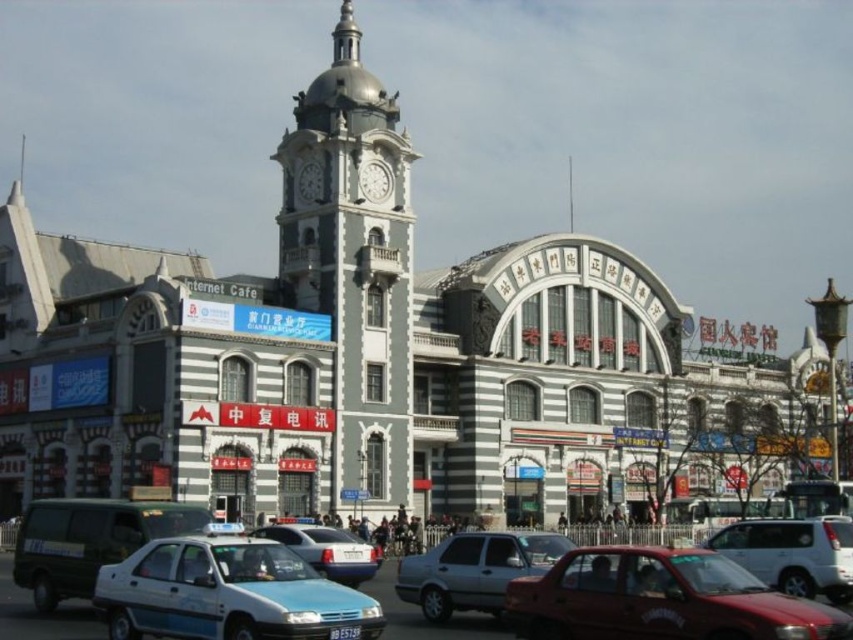
Does silver metallic sedan at center appear on the right side of white metallic clock at upper center?

Indeed, silver metallic sedan at center is positioned on the right side of white metallic clock at upper center.

Is silver metallic sedan at center taller than white metallic clock at upper center?

Yes.

Does point (498, 566) lie behind point (379, 173)?

No, (498, 566) is in front of (379, 173).

The height and width of the screenshot is (640, 853). Find the location of `silver metallic sedan at center`. silver metallic sedan at center is located at coordinates (474, 570).

Can you confirm if shiny red sedan at lower right is smaller than light blue plastic car at lower center?

No.

Can you confirm if shiny red sedan at lower right is wider than light blue plastic car at lower center?

In fact, shiny red sedan at lower right might be narrower than light blue plastic car at lower center.

Is point (624, 630) in front of point (141, 589)?

Yes, it is.

This screenshot has height=640, width=853. I want to click on shiny red sedan at lower right, so click(x=660, y=600).

Is point (328, 211) in front of point (815, 611)?

That is False.

Which is in front, point (344, 211) or point (666, 621)?

Point (666, 621) is in front.

The width and height of the screenshot is (853, 640). What do you see at coordinates (354, 269) in the screenshot?
I see `silver metallic clock tower at center` at bounding box center [354, 269].

You are a GUI agent. You are given a task and a screenshot of the screen. Output one action in this format:
    pyautogui.click(x=<x>, y=<y>)
    Task: Click on the silver metallic clock tower at center
    The height and width of the screenshot is (640, 853).
    Given the screenshot: What is the action you would take?
    click(354, 269)